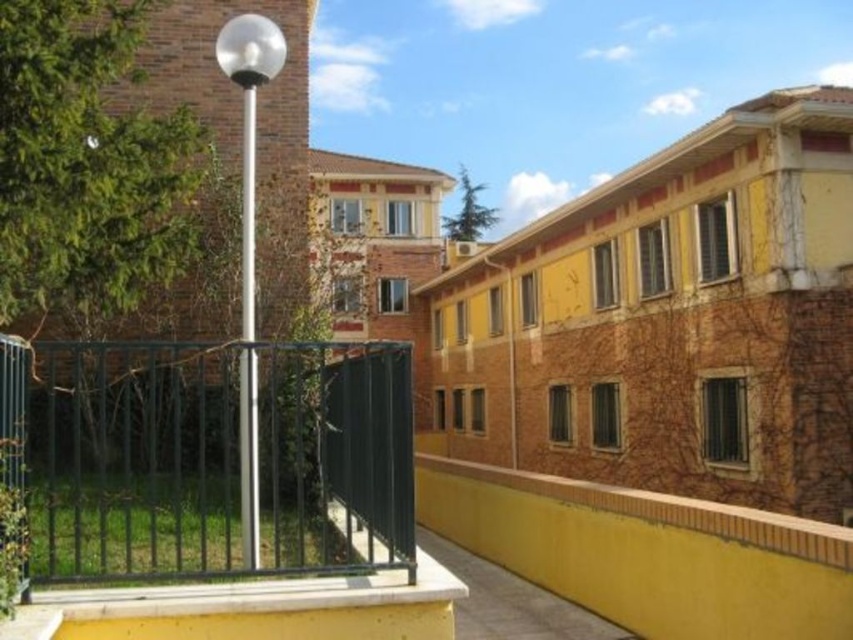
Between green metal fence at lower left and silver metallic pole at center, which one appears on the right side from the viewer's perspective?

From the viewer's perspective, silver metallic pole at center appears more on the right side.

Which is in front, point (102, 417) or point (254, 369)?

Point (102, 417) is in front.

I want to click on green metal fence at lower left, so click(x=207, y=456).

Consider the image. Does silver metallic pole at center appear on the left side of polished metal pole at center?

Incorrect, silver metallic pole at center is not on the left side of polished metal pole at center.

Is point (263, 61) positioned behind point (250, 209)?

No.

Measure the distance between point (258, 51) and camera.

5.51 meters

The height and width of the screenshot is (640, 853). In order to click on silver metallic pole at center in this screenshot , I will do `click(248, 122)`.

Which of these two, green metal fence at lower left or polished metal pole at center, stands taller?

polished metal pole at center is taller.

Is green metal fence at lower left to the right of polished metal pole at center from the viewer's perspective?

No, green metal fence at lower left is not to the right of polished metal pole at center.

Is point (196, 369) less distant than point (242, 486)?

No, it is behind (242, 486).

This screenshot has height=640, width=853. What are the coordinates of `green metal fence at lower left` in the screenshot? It's located at (207, 456).